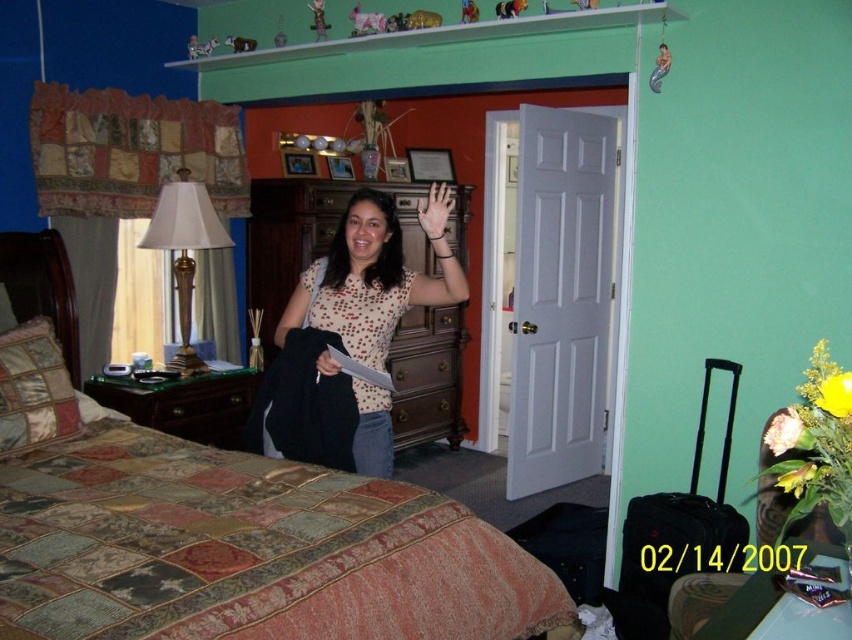
Between patchwork quilted bed at center and polka dot blouse at center, which one appears on the left side from the viewer's perspective?

From the viewer's perspective, patchwork quilted bed at center appears more on the left side.

Is point (50, 625) farther from viewer compared to point (456, 257)?

No, it is not.

You are a GUI agent. You are given a task and a screenshot of the screen. Output one action in this format:
    pyautogui.click(x=<x>, y=<y>)
    Task: Click on the patchwork quilted bed at center
    
    Given the screenshot: What is the action you would take?
    pyautogui.click(x=246, y=550)

This screenshot has width=852, height=640. I want to click on patchwork quilted bed at center, so click(246, 550).

Who is taller, patchwork quilted bed at center or smooth black hand at center?

patchwork quilted bed at center

Is patchwork quilted bed at center taller than smooth black hand at center?

Yes.

Where is `patchwork quilted bed at center`? The image size is (852, 640). patchwork quilted bed at center is located at coordinates (246, 550).

This screenshot has height=640, width=852. I want to click on patchwork quilted bed at center, so click(246, 550).

Which of these two, patchwork quilted bed at center or pale skin at center, stands taller?

Standing taller between the two is patchwork quilted bed at center.

Does patchwork quilted bed at center lie behind pale skin at center?

No.

Image resolution: width=852 pixels, height=640 pixels. What are the coordinates of `patchwork quilted bed at center` in the screenshot? It's located at (246, 550).